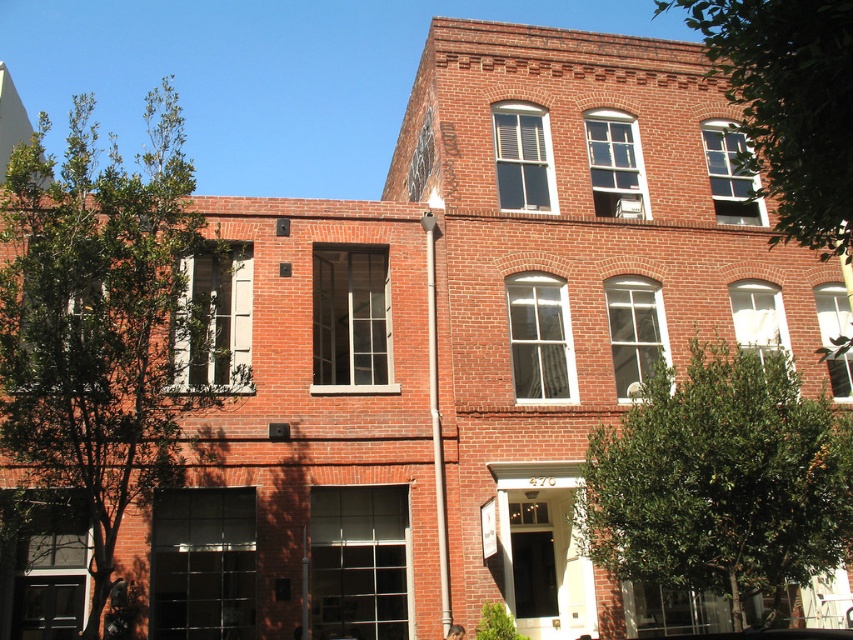
You are a gardener planning to plant a new tree in the yard of the two story brick building. You want to ensure that the new tree will not block the sunlight to the existing green leafy tree at center and green leafy tree at upper right. Given that the minimum spacing between trees for proper sunlight is 5 meters, will the existing trees meet this requirement?

The green leafy tree at center and green leafy tree at upper right are 5.72 meters apart, which exceeds the minimum spacing requirement of 5 meters. Therefore, the existing trees already meet the sunlight requirement.